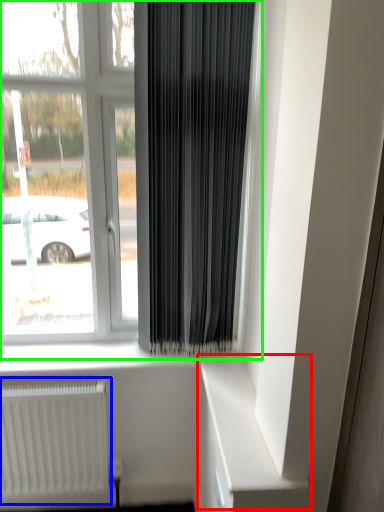
Question: Which object is the closest to the shelf (highlighted by a red box)? Choose among these: radiator (highlighted by a blue box) or window (highlighted by a green box).

Choices:
 (A) radiator
 (B) window

Answer: (A)